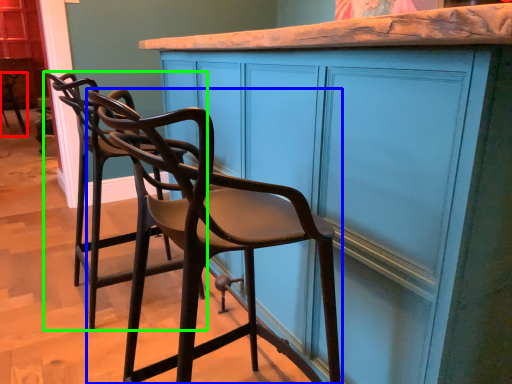
Question: Estimate the real-world distances between objects in this image. Which object is farther from chair (highlighted by a red box), chair (highlighted by a blue box) or chair (highlighted by a green box)?

Choices:
 (A) chair
 (B) chair

Answer: (A)